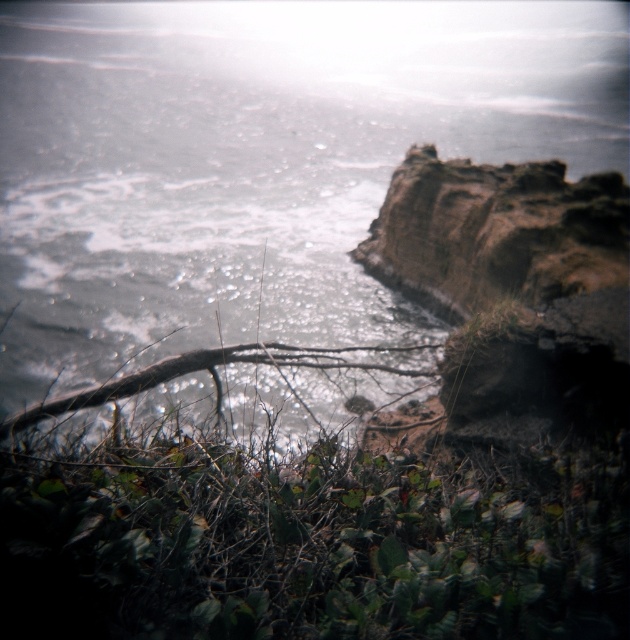
Is glistening water at cliff edge taller than green leafy vegetation at center?

Indeed, glistening water at cliff edge has a greater height compared to green leafy vegetation at center.

Who is more distant from viewer, (570, 10) or (232, 496)?

The point (570, 10) is behind.

I want to click on glistening water at cliff edge, so click(x=256, y=163).